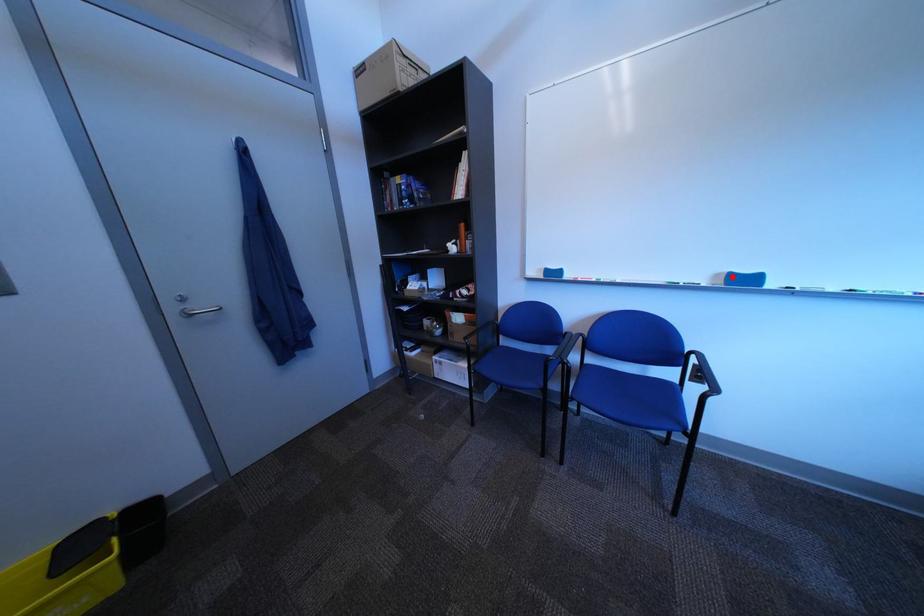
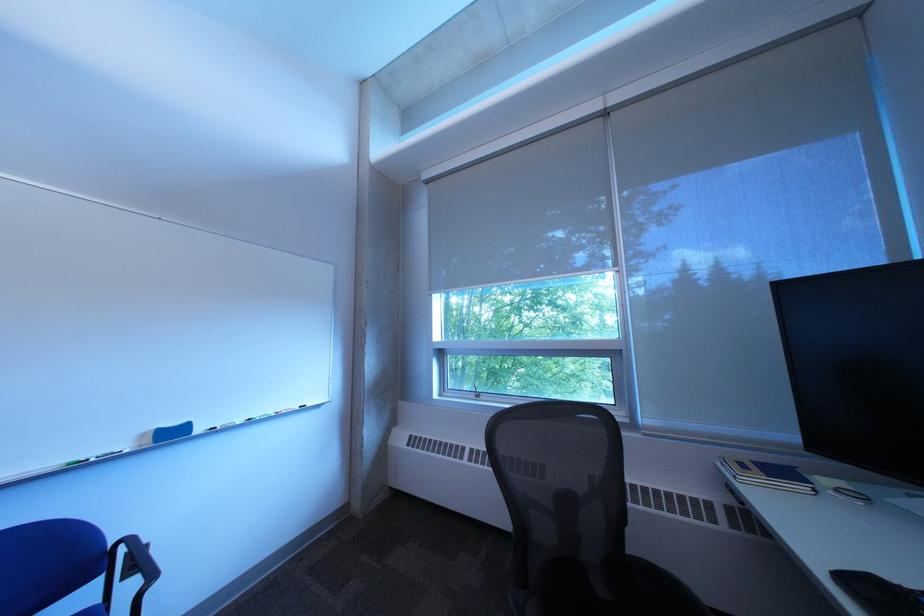
Question: I am providing you with two images of the same scene from different viewpoints. A red point is marked on the first image. Is the red point's position out of view in image 2?

Choices:
 (A) Yes
 (B) No

Answer: (B)